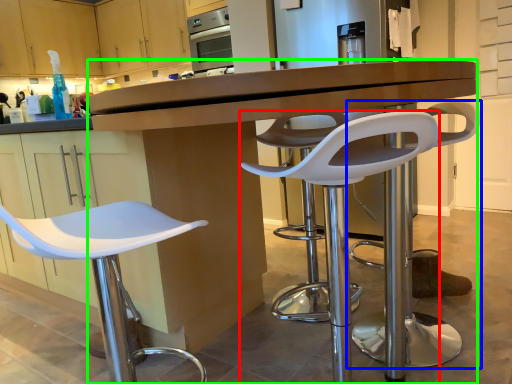
Question: Which object is the farthest from chair (highlighted by a red box)? Choose among these: chair (highlighted by a blue box) or desk (highlighted by a green box).

Choices:
 (A) chair
 (B) desk

Answer: (B)